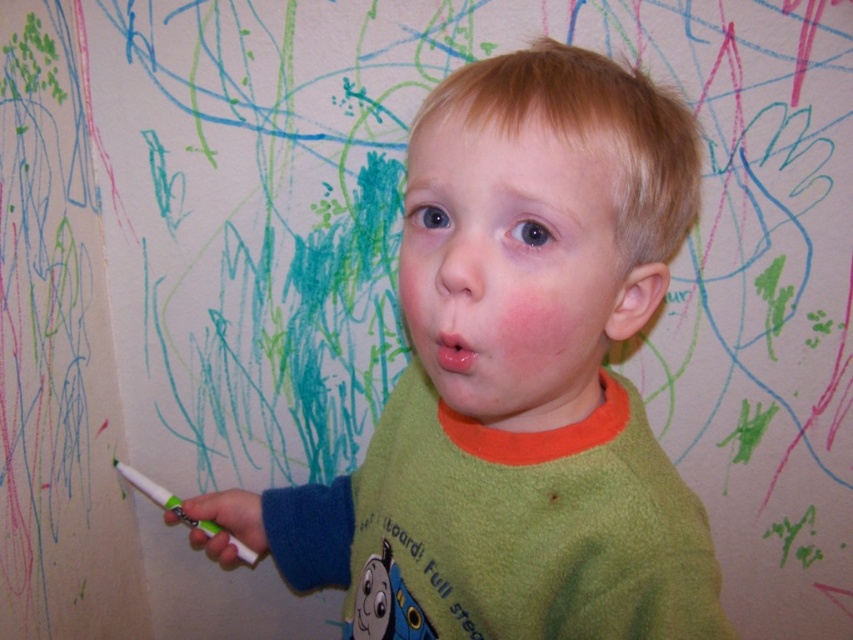
The child is wearing a green fleece shirt at center and holding a white plastic crayon at lower left. Which object is positioned to the right of the other?

The green fleece shirt at center is to the right of the white plastic crayon at lower left.